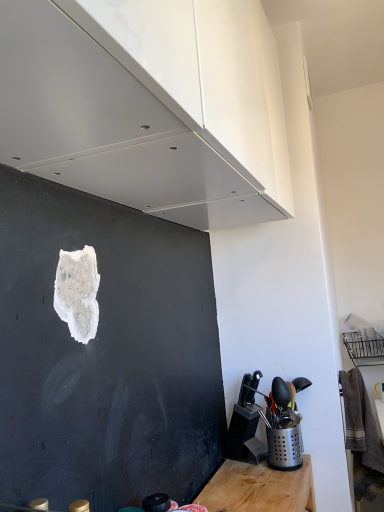
Question: Considering the relative sizes of white glossy cabinet at upper center and silver perforated utensil holder at lower right in the image provided, is white glossy cabinet at upper center bigger than silver perforated utensil holder at lower right?

Choices:
 (A) yes
 (B) no

Answer: (A)

Question: Is white glossy cabinet at upper center next to silver perforated utensil holder at lower right and touching it?

Choices:
 (A) no
 (B) yes

Answer: (A)

Question: Can you confirm if white glossy cabinet at upper center is positioned to the left of silver perforated utensil holder at lower right?

Choices:
 (A) yes
 (B) no

Answer: (A)

Question: Would you say white glossy cabinet at upper center contains silver perforated utensil holder at lower right?

Choices:
 (A) yes
 (B) no

Answer: (B)

Question: Can you confirm if white glossy cabinet at upper center is shorter than silver perforated utensil holder at lower right?

Choices:
 (A) yes
 (B) no

Answer: (B)

Question: Considering the relative sizes of white glossy cabinet at upper center and silver perforated utensil holder at lower right in the image provided, is white glossy cabinet at upper center taller than silver perforated utensil holder at lower right?

Choices:
 (A) no
 (B) yes

Answer: (B)

Question: Is silver perforated utensil holder at lower right turned away from white glossy cabinet at upper center?

Choices:
 (A) yes
 (B) no

Answer: (B)

Question: Is silver perforated utensil holder at lower right wider than white glossy cabinet at upper center?

Choices:
 (A) no
 (B) yes

Answer: (A)

Question: Could you tell me if silver perforated utensil holder at lower right is turned towards white glossy cabinet at upper center?

Choices:
 (A) yes
 (B) no

Answer: (B)

Question: Is silver perforated utensil holder at lower right shorter than white glossy cabinet at upper center?

Choices:
 (A) yes
 (B) no

Answer: (A)

Question: Is silver perforated utensil holder at lower right directly adjacent to white glossy cabinet at upper center?

Choices:
 (A) yes
 (B) no

Answer: (B)

Question: Does silver perforated utensil holder at lower right lie in front of white glossy cabinet at upper center?

Choices:
 (A) yes
 (B) no

Answer: (B)

Question: Is white glossy cabinet at upper center in front of or behind silver perforated utensil holder at lower right in the image?

Choices:
 (A) behind
 (B) front

Answer: (B)